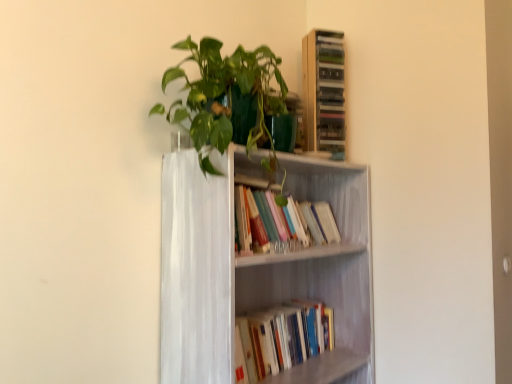
Question: Considering the relative sizes of wooden cabinet at upper right and hardcover books at center, the second book when ordered from top to bottom, in the image provided, is wooden cabinet at upper right wider than hardcover books at center, the second book when ordered from top to bottom,?

Choices:
 (A) yes
 (B) no

Answer: (B)

Question: Could you tell me if wooden cabinet at upper right is facing hardcover books at center, the first book in the bottom-to-top sequence?

Choices:
 (A) no
 (B) yes

Answer: (A)

Question: Are wooden cabinet at upper right and hardcover books at center, the second book when ordered from top to bottom, beside each other?

Choices:
 (A) no
 (B) yes

Answer: (A)

Question: Is wooden cabinet at upper right outside of hardcover books at center, the second book when ordered from top to bottom?

Choices:
 (A) yes
 (B) no

Answer: (A)

Question: Does wooden cabinet at upper right lie in front of hardcover books at center, the first book in the bottom-to-top sequence?

Choices:
 (A) yes
 (B) no

Answer: (B)

Question: In the image, is hardcover books at center, the second book when ordered from top to bottom, positioned in front of or behind wooden cabinet at upper right?

Choices:
 (A) behind
 (B) front

Answer: (B)

Question: Considering the relative positions of hardcover books at center, the first book in the bottom-to-top sequence, and wooden cabinet at upper right in the image provided, is hardcover books at center, the first book in the bottom-to-top sequence, to the left or to the right of wooden cabinet at upper right?

Choices:
 (A) left
 (B) right

Answer: (A)

Question: Based on their sizes in the image, would you say hardcover books at center, the second book when ordered from top to bottom, is bigger or smaller than wooden cabinet at upper right?

Choices:
 (A) small
 (B) big

Answer: (B)

Question: From their relative heights in the image, would you say hardcover books at center, the second book when ordered from top to bottom, is taller or shorter than wooden cabinet at upper right?

Choices:
 (A) tall
 (B) short

Answer: (B)

Question: Considering the positions of hardcover books at center, the first book in the bottom-to-top sequence, and white painted wood bookcase at center in the image, is hardcover books at center, the first book in the bottom-to-top sequence, bigger or smaller than white painted wood bookcase at center?

Choices:
 (A) big
 (B) small

Answer: (B)

Question: From the image's perspective, is hardcover books at center, the first book in the bottom-to-top sequence, located above or below white painted wood bookcase at center?

Choices:
 (A) below
 (B) above

Answer: (A)

Question: From a real-world perspective, is hardcover books at center, the second book when ordered from top to bottom, positioned above or below white painted wood bookcase at center?

Choices:
 (A) below
 (B) above

Answer: (A)

Question: Is hardcover books at center, the first book in the bottom-to-top sequence, wider or thinner than white painted wood bookcase at center?

Choices:
 (A) wide
 (B) thin

Answer: (B)

Question: Looking at their shapes, would you say wooden cabinet at upper right is wider or thinner than white painted wood bookcase at center?

Choices:
 (A) thin
 (B) wide

Answer: (A)

Question: Is wooden cabinet at upper right spatially inside white painted wood bookcase at center, or outside of it?

Choices:
 (A) outside
 (B) inside

Answer: (A)